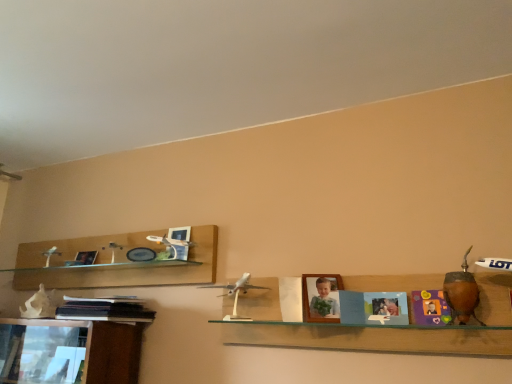
This screenshot has width=512, height=384. Describe the element at coordinates (321, 297) in the screenshot. I see `wooden photo frame at center, which is counted as the second picture frame, starting from the left` at that location.

Image resolution: width=512 pixels, height=384 pixels. What do you see at coordinates (260, 299) in the screenshot?
I see `silver metallic airplane at center, which is the 1th toy from left to right` at bounding box center [260, 299].

What do you see at coordinates (382, 325) in the screenshot?
I see `white plastic airplane at center` at bounding box center [382, 325].

You are a GUI agent. You are given a task and a screenshot of the screen. Output one action in this format:
    pyautogui.click(x=<x>, y=<y>)
    Task: Click on the matte plastic picture frame at upper left, positioned as the second picture frame in front-to-back order
    The width and height of the screenshot is (512, 384).
    Given the screenshot: What is the action you would take?
    pyautogui.click(x=85, y=258)

There is a black matte book at lower left. Identify the location of the 1st picture frame above it (from a real-world perspective). (321, 297).

Does black matte book at lower left lie in front of wooden photo frame at center, which is counted as the second picture frame, starting from the left?

No.

From a real-world perspective, is black matte book at lower left beneath wooden photo frame at center, marked as the 1th picture frame in a front-to-back arrangement?

→ Yes, from a real-world perspective, black matte book at lower left is below wooden photo frame at center, marked as the 1th picture frame in a front-to-back arrangement.

Measure the distance from white plastic airplane at center to silver metallic airplane at center, the 1th toy positioned from the back.

A distance of 18.91 centimeters exists between white plastic airplane at center and silver metallic airplane at center, the 1th toy positioned from the back.

Relative to silver metallic airplane at center, acting as the second toy starting from the right, is white plastic airplane at center in front or behind?

Visually, white plastic airplane at center is located in front of silver metallic airplane at center, acting as the second toy starting from the right.

From the image's perspective, between white plastic airplane at center and silver metallic airplane at center, the 1th toy positioned from the back, which one is located above?

silver metallic airplane at center, the 1th toy positioned from the back.

Is white plastic airplane at center shorter than silver metallic airplane at center, the 1th toy positioned from the back?

Incorrect, the height of white plastic airplane at center does not fall short of that of silver metallic airplane at center, the 1th toy positioned from the back.

Looking at the image, does white plastic airplane at center seem bigger or smaller compared to wooden photo frame at center, marked as the 1th picture frame in a front-to-back arrangement?

white plastic airplane at center is bigger than wooden photo frame at center, marked as the 1th picture frame in a front-to-back arrangement.

Consider the image. Is white plastic airplane at center facing towards wooden photo frame at center, marked as the 1th picture frame in a front-to-back arrangement?

Yes, white plastic airplane at center faces towards wooden photo frame at center, marked as the 1th picture frame in a front-to-back arrangement.

Locate an element on the screen. The height and width of the screenshot is (384, 512). picture frame that is the 1st object to the left of the white plastic airplane at center, starting at the anchor is located at coordinates (321, 297).

Measure the distance from white plastic airplane at center to wooden photo frame at center, which is counted as the second picture frame, starting from the left.

white plastic airplane at center and wooden photo frame at center, which is counted as the second picture frame, starting from the left, are 7.70 inches apart.

From the image's perspective, is wooden photo frame at center, marked as the 1th picture frame in a front-to-back arrangement, above or below matte plastic picture frame at upper left, which is the 2th picture frame from right to left?

From the image's perspective, wooden photo frame at center, marked as the 1th picture frame in a front-to-back arrangement, appears below matte plastic picture frame at upper left, which is the 2th picture frame from right to left.

Can you tell me how much wooden photo frame at center, marked as the 1th picture frame in a front-to-back arrangement, and matte plastic picture frame at upper left, the 1th picture frame in the back-to-front sequence, differ in facing direction?

The facing directions of wooden photo frame at center, marked as the 1th picture frame in a front-to-back arrangement, and matte plastic picture frame at upper left, the 1th picture frame in the back-to-front sequence, are 26 degrees apart.

Considering the points (327, 281) and (89, 258), which point is behind, point (327, 281) or point (89, 258)?

Point (89, 258)

Is wooden photo frame at center, arranged as the first picture frame when viewed from the right, spatially inside matte plastic picture frame at upper left, positioned as the second picture frame in front-to-back order, or outside of it?

wooden photo frame at center, arranged as the first picture frame when viewed from the right, is located beyond the bounds of matte plastic picture frame at upper left, positioned as the second picture frame in front-to-back order.

Is wooden photo frame at center, arranged as the first picture frame when viewed from the right, positioned beyond the bounds of brown wooden vase at right, which is counted as the 2th toy, starting from the left?

Yes.

Between wooden photo frame at center, arranged as the first picture frame when viewed from the right, and brown wooden vase at right, which appears as the 1th toy when viewed from the right, which one appears on the left side from the viewer's perspective?

Positioned to the left is wooden photo frame at center, arranged as the first picture frame when viewed from the right.

Does point (338, 286) come closer to viewer compared to point (473, 312)?

That is False.

From the image's perspective, is black matte book at lower left located above or below white plastic airplane at center?

From the image's perspective, black matte book at lower left appears below white plastic airplane at center.

You are a GUI agent. You are given a task and a screenshot of the screen. Output one action in this format:
    pyautogui.click(x=<x>, y=<y>)
    Task: Click on the book on the left of white plastic airplane at center
    This screenshot has height=384, width=512.
    Given the screenshot: What is the action you would take?
    pyautogui.click(x=105, y=309)

Considering the relative sizes of black matte book at lower left and white plastic airplane at center in the image provided, is black matte book at lower left thinner than white plastic airplane at center?

No, black matte book at lower left is not thinner than white plastic airplane at center.

Between point (94, 259) and point (408, 294), which one is positioned in front?

Positioned in front is point (408, 294).

Based on their sizes in the image, would you say matte plastic picture frame at upper left, which is counted as the first picture frame, starting from the left, is bigger or smaller than white plastic airplane at center?

Clearly, matte plastic picture frame at upper left, which is counted as the first picture frame, starting from the left, is smaller in size than white plastic airplane at center.

From the image's perspective, between matte plastic picture frame at upper left, the 1th picture frame in the back-to-front sequence, and white plastic airplane at center, which one is located above?

matte plastic picture frame at upper left, the 1th picture frame in the back-to-front sequence, is shown above in the image.

Where is `book below the wooden photo frame at center, marked as the 1th picture frame in a front-to-back arrangement (from a real-world perspective)`? The height and width of the screenshot is (384, 512). book below the wooden photo frame at center, marked as the 1th picture frame in a front-to-back arrangement (from a real-world perspective) is located at coordinates (105, 309).

At what (x,y) coordinates should I click in order to perform the action: click on shelf below the silver metallic airplane at center, which is the 1th toy from left to right (from the image's perspective). Please return your answer as a coordinate pair (x, y). Looking at the image, I should click on (382, 325).

In the scene shown: Based on their spatial positions, is wooden photo frame at center, marked as the 1th picture frame in a front-to-back arrangement, or silver metallic airplane at center, acting as the second toy starting from the right, closer to white plastic airplane at center?

silver metallic airplane at center, acting as the second toy starting from the right, is closer to white plastic airplane at center.

Looking at the image, which one is located further to silver metallic airplane at center, which is the 1th toy from left to right, brown wooden vase at right, positioned as the 1th toy in front-to-back order, or wooden photo frame at center, arranged as the first picture frame when viewed from the right?

brown wooden vase at right, positioned as the 1th toy in front-to-back order, lies further to silver metallic airplane at center, which is the 1th toy from left to right, than the other object.

Looking at this image, which object lies nearer to the anchor point matte plastic picture frame at upper left, which is counted as the first picture frame, starting from the left, brown wooden vase at right, positioned as the 1th toy in front-to-back order, or silver metallic airplane at center, acting as the second toy starting from the right?

Based on the image, silver metallic airplane at center, acting as the second toy starting from the right, appears to be nearer to matte plastic picture frame at upper left, which is counted as the first picture frame, starting from the left.

Looking at the image, which one is located closer to white plastic airplane at center, silver metallic airplane at center, the 1th toy positioned from the back, or brown wooden vase at right, which is counted as the 2th toy, starting from the left?

silver metallic airplane at center, the 1th toy positioned from the back, is positioned closer to the anchor white plastic airplane at center.

Which object lies further to the anchor point black matte book at lower left, brown wooden vase at right, positioned as the 1th toy in front-to-back order, or wooden photo frame at center, arranged as the first picture frame when viewed from the right?

Among the two, brown wooden vase at right, positioned as the 1th toy in front-to-back order, is located further to black matte book at lower left.

Considering their positions, is matte plastic picture frame at upper left, which is counted as the first picture frame, starting from the left, positioned closer to silver metallic airplane at center, which is the 1th toy from left to right, than brown wooden vase at right, positioned as the 1th toy in front-to-back order?

brown wooden vase at right, positioned as the 1th toy in front-to-back order.

Which object lies further to the anchor point matte plastic picture frame at upper left, which is the 2th picture frame from right to left, black matte book at lower left or white plastic airplane at center?

Based on the image, white plastic airplane at center appears to be further to matte plastic picture frame at upper left, which is the 2th picture frame from right to left.

Estimate the real-world distances between objects in this image. Which object is further from silver metallic airplane at center, which is the 1th toy from left to right, black matte book at lower left or matte plastic picture frame at upper left, positioned as the second picture frame in front-to-back order?

Among the two, matte plastic picture frame at upper left, positioned as the second picture frame in front-to-back order, is located further to silver metallic airplane at center, which is the 1th toy from left to right.

You are a GUI agent. You are given a task and a screenshot of the screen. Output one action in this format:
    pyautogui.click(x=<x>, y=<y>)
    Task: Click on the book between matte plastic picture frame at upper left, which is counted as the first picture frame, starting from the left, and brown wooden vase at right, positioned as the 1th toy in front-to-back order, from left to right
    
    Given the screenshot: What is the action you would take?
    pyautogui.click(x=105, y=309)

The height and width of the screenshot is (384, 512). Find the location of `picture frame between matte plastic picture frame at upper left, the 1th picture frame in the back-to-front sequence, and white plastic airplane at center`. picture frame between matte plastic picture frame at upper left, the 1th picture frame in the back-to-front sequence, and white plastic airplane at center is located at coordinates (321, 297).

Image resolution: width=512 pixels, height=384 pixels. What are the coordinates of `shelf between silver metallic airplane at center, acting as the second toy starting from the right, and brown wooden vase at right, which is counted as the 2th toy, starting from the left, in the horizontal direction` in the screenshot? It's located at [x=382, y=325].

What are the coordinates of `shelf situated between matte plastic picture frame at upper left, which is the 2th picture frame from right to left, and brown wooden vase at right, which appears as the 1th toy when viewed from the right, from left to right` in the screenshot? It's located at (382, 325).